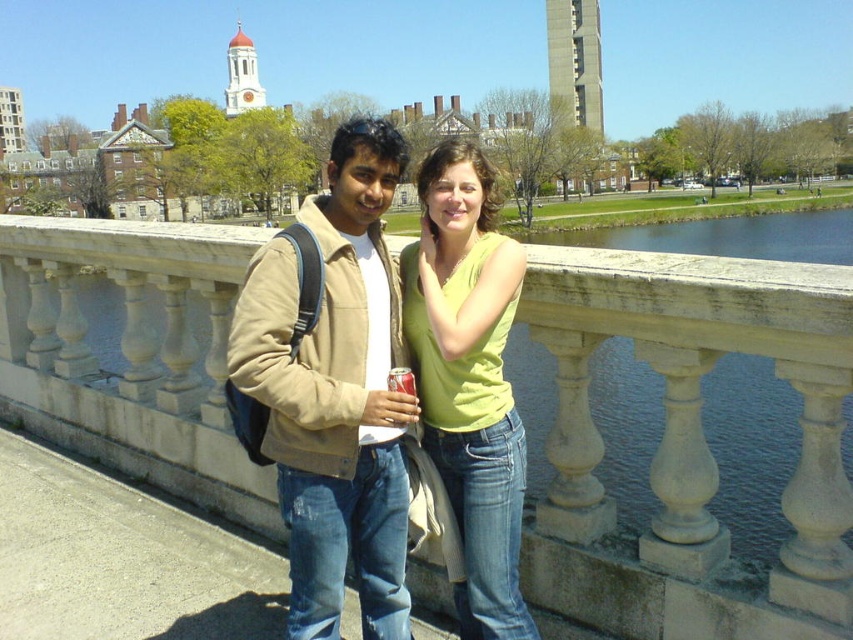
Question: Among these points, which one is farthest from the camera?

Choices:
 (A) (567, 422)
 (B) (254, 326)

Answer: (A)

Question: Which point appears closest to the camera in this image?

Choices:
 (A) (486, 161)
 (B) (409, 385)

Answer: (B)

Question: Observing the image, what is the correct spatial positioning of matte beige jacket at center in reference to matte red can at center?

Choices:
 (A) below
 (B) above

Answer: (B)

Question: Is white stone bridge at center closer to the viewer compared to matte beige jacket at center?

Choices:
 (A) no
 (B) yes

Answer: (B)

Question: Is white stone bridge at center further to camera compared to lime green jersey at center?

Choices:
 (A) no
 (B) yes

Answer: (A)

Question: Which point is farther to the camera?

Choices:
 (A) lime green jersey at center
 (B) matte beige jacket at center
 (C) white stone bridge at center

Answer: (A)